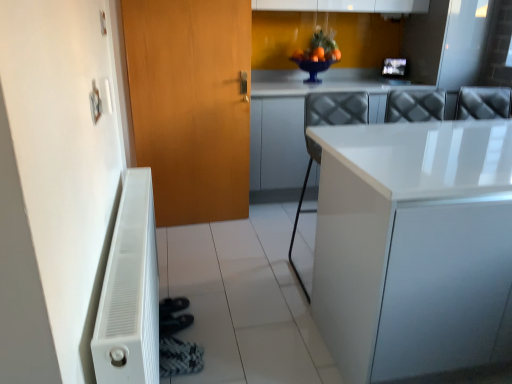
Question: Can you confirm if black textured shoe at lower left is thinner than wooden door at left?

Choices:
 (A) yes
 (B) no

Answer: (B)

Question: From the image's perspective, would you say black textured shoe at lower left is shown under wooden door at left?

Choices:
 (A) no
 (B) yes

Answer: (B)

Question: Does black textured shoe at lower left touch wooden door at left?

Choices:
 (A) yes
 (B) no

Answer: (B)

Question: Does black textured shoe at lower left appear on the left side of wooden door at left?

Choices:
 (A) yes
 (B) no

Answer: (B)

Question: Is black textured shoe at lower left at the right side of wooden door at left?

Choices:
 (A) no
 (B) yes

Answer: (B)

Question: Based on their sizes in the image, would you say white glossy counter top at upper right is bigger or smaller than white glossy countertop at center?

Choices:
 (A) big
 (B) small

Answer: (B)

Question: Is white glossy counter top at upper right to the left or to the right of white glossy countertop at center in the image?

Choices:
 (A) left
 (B) right

Answer: (A)

Question: Considering the positions of point click(262, 74) and point click(373, 253), is point click(262, 74) closer or farther from the camera than point click(373, 253)?

Choices:
 (A) farther
 (B) closer

Answer: (A)

Question: Is white glossy counter top at upper right spatially inside white glossy countertop at center, or outside of it?

Choices:
 (A) inside
 (B) outside

Answer: (B)

Question: Do you think black textured shoe at lower left is within white matte radiator at lower left, or outside of it?

Choices:
 (A) outside
 (B) inside

Answer: (A)

Question: Considering the relative positions of black textured shoe at lower left and white matte radiator at lower left in the image provided, is black textured shoe at lower left to the left or to the right of white matte radiator at lower left?

Choices:
 (A) right
 (B) left

Answer: (A)

Question: Is black textured shoe at lower left taller or shorter than white matte radiator at lower left?

Choices:
 (A) tall
 (B) short

Answer: (B)

Question: Does point (181, 340) appear closer or farther from the camera than point (151, 278)?

Choices:
 (A) farther
 (B) closer

Answer: (A)

Question: Considering the positions of wooden door at left and black textured shoe at lower left in the image, is wooden door at left wider or thinner than black textured shoe at lower left?

Choices:
 (A) thin
 (B) wide

Answer: (A)

Question: From a real-world perspective, is wooden door at left positioned above or below black textured shoe at lower left?

Choices:
 (A) above
 (B) below

Answer: (A)